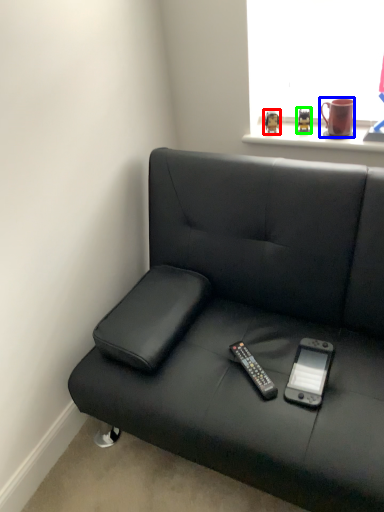
Question: Which is farther away from toy (highlighted by a red box)? mug (highlighted by a blue box) or toy (highlighted by a green box)?

Choices:
 (A) mug
 (B) toy

Answer: (A)